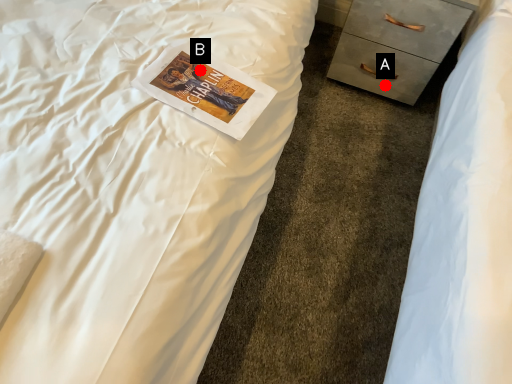
Question: Two points are circled on the image, labeled by A and B beside each circle. Which point is closer to the camera?

Choices:
 (A) A is closer
 (B) B is closer

Answer: (B)